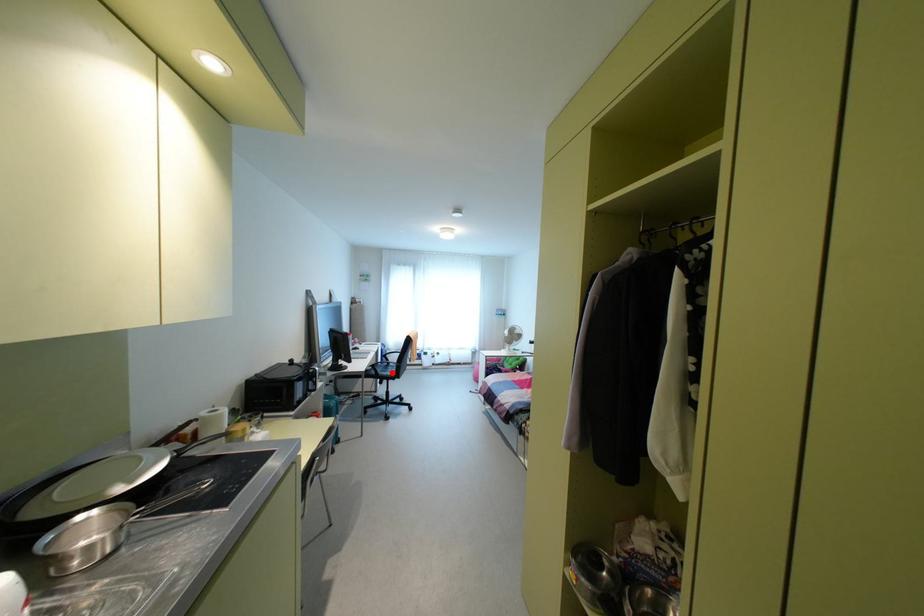
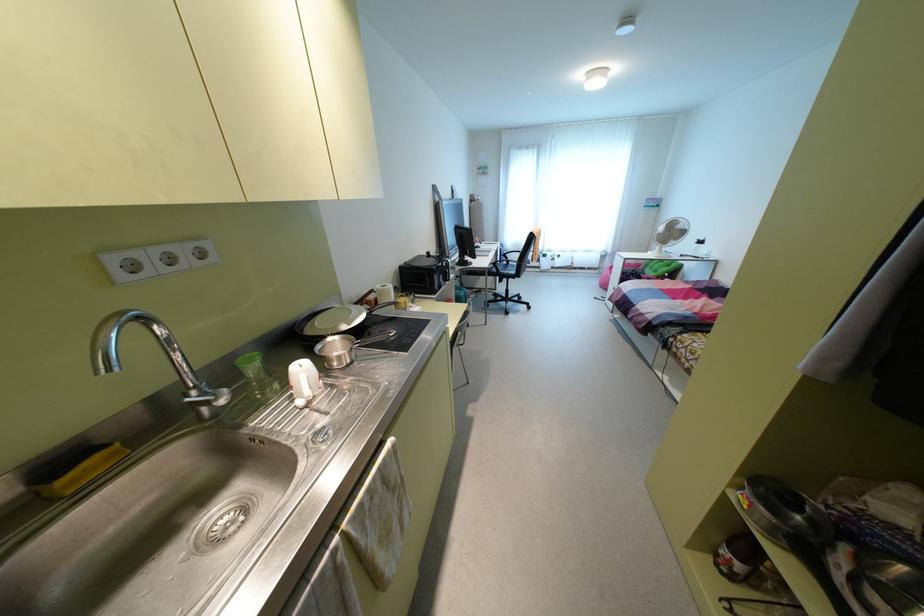
Question: I am providing you with two images of the same scene from different viewpoints. Given a red point in image1, look at the same physical point in image2. Is it:

Choices:
 (A) Closer to the viewpoint
 (B) Farther from the viewpoint

Answer: (B)